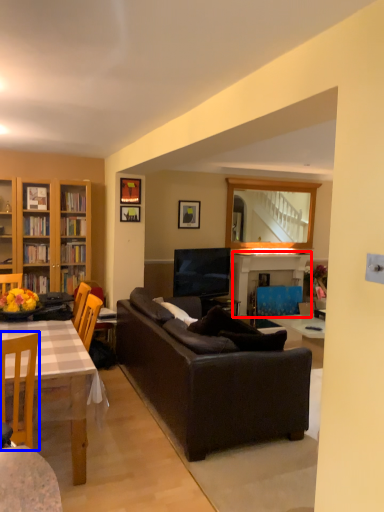
Question: Which of the following is the farthest to the observer, fireplace (highlighted by a red box) or chair (highlighted by a blue box)?

Choices:
 (A) fireplace
 (B) chair

Answer: (A)